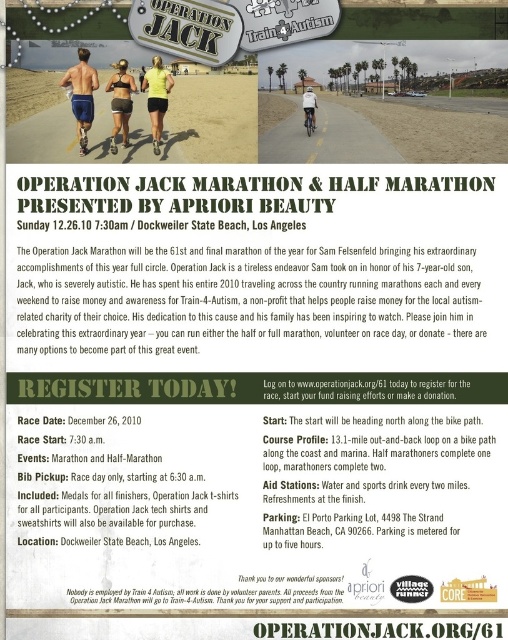
Is yellow matte shirt at center thinner than white matte helmet at upper center?

No.

At what (x,y) coordinates should I click in order to perform the action: click on yellow matte shirt at center. Please return your answer as a coordinate pair (x, y). Looking at the image, I should click on (156, 97).

Locate an element on the screen. Image resolution: width=508 pixels, height=640 pixels. yellow matte shirt at center is located at coordinates coord(156,97).

Where is `yellow matte shirt at center`? Image resolution: width=508 pixels, height=640 pixels. yellow matte shirt at center is located at coordinates (156, 97).

Looking at this image, can you confirm if matte blue shorts at center is positioned to the left of yellow matte shirt at center?

Correct, you'll find matte blue shorts at center to the left of yellow matte shirt at center.

Which is in front, point (84, 104) or point (154, 115)?

Point (84, 104) is more forward.

The width and height of the screenshot is (508, 640). What do you see at coordinates (81, 93) in the screenshot?
I see `matte blue shorts at center` at bounding box center [81, 93].

The height and width of the screenshot is (640, 508). Identify the location of matte blue shorts at center. (81, 93).

Between point (125, 92) and point (165, 86), which one is positioned in front?

Positioned in front is point (165, 86).

Image resolution: width=508 pixels, height=640 pixels. Find the location of `matte black sports bra at center`. matte black sports bra at center is located at coordinates (120, 102).